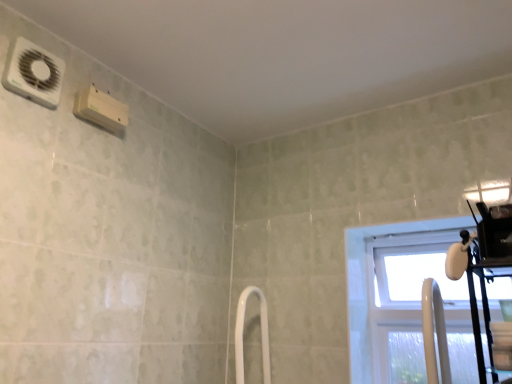
Question: From a real-world perspective, is white plastic air conditioning unit at upper left positioned above or below transparent plastic window at right?

Choices:
 (A) above
 (B) below

Answer: (A)

Question: In the image, is white plastic air conditioning unit at upper left positioned in front of or behind transparent plastic window at right?

Choices:
 (A) behind
 (B) front

Answer: (B)

Question: Based on their relative distances, which object is nearer to the white glossy shower door at center?

Choices:
 (A) white plastic air conditioning unit at upper left
 (B) transparent plastic window at right

Answer: (B)

Question: Which object is the farthest from the transparent plastic window at right?

Choices:
 (A) white plastic air conditioning unit at upper left
 (B) white glossy shower door at center

Answer: (A)